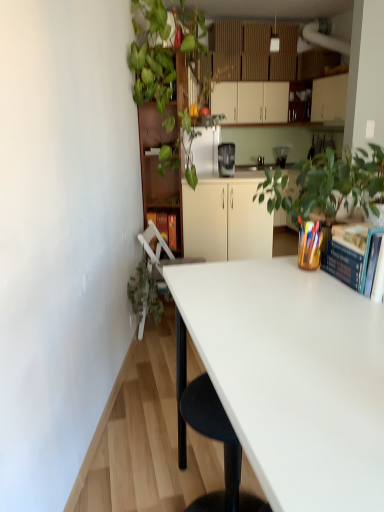
Question: Is point (266, 293) positioned closer to the camera than point (221, 153)?

Choices:
 (A) farther
 (B) closer

Answer: (B)

Question: Considering the positions of white glossy desk at center and satin black coffee maker at center in the image, is white glossy desk at center wider or thinner than satin black coffee maker at center?

Choices:
 (A) wide
 (B) thin

Answer: (A)

Question: Which is farther from the white plastic chair at lower left?

Choices:
 (A) blue hardcover book at upper right
 (B) brown wooden bookshelf at upper center
 (C) green leafy plant at upper left, arranged as the 1th vegetation when viewed from the top
 (D) satin black coffee maker at center
 (E) white matte cabinet at upper center, which is counted as the 2th cabinetry, starting from the bottom

Answer: (E)

Question: Estimate the real-world distances between objects in this image. Which object is farther from the green leafy plant at upper left, the 2th vegetation from the bottom?

Choices:
 (A) satin black coffee maker at center
 (B) white plastic chair at lower left
 (C) white matte cabinet at upper center, marked as the 2th cabinetry in a front-to-back arrangement
 (D) white glossy desk at center
 (E) matte black coffee maker at center

Answer: (E)